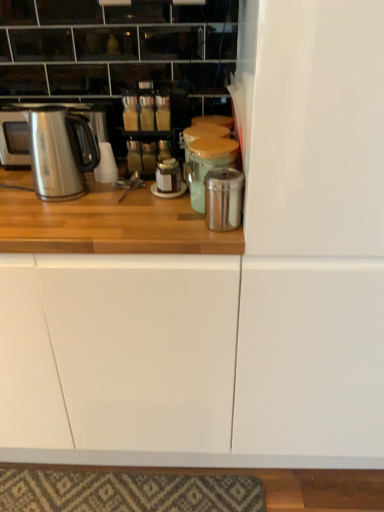
Question: Are metallic silver canister at center, which is counted as the 1th appliance, starting from the back, and shiny metallic canister at center, the 2th appliance viewed from the back, far apart?

Choices:
 (A) no
 (B) yes

Answer: (A)

Question: Does metallic silver canister at center, the second appliance from the front, have a greater width compared to shiny metallic canister at center, the 2th appliance viewed from the back?

Choices:
 (A) no
 (B) yes

Answer: (B)

Question: From a real-world perspective, is metallic silver canister at center, which is counted as the 1th appliance, starting from the back, on shiny metallic canister at center, arranged as the first appliance when viewed from the front?

Choices:
 (A) no
 (B) yes

Answer: (B)

Question: From the image's perspective, is metallic silver canister at center, which is counted as the 1th appliance, starting from the back, on top of shiny metallic canister at center, arranged as the first appliance when viewed from the front?

Choices:
 (A) no
 (B) yes

Answer: (B)

Question: Can you confirm if metallic silver canister at center, the second appliance from the front, is thinner than shiny metallic canister at center, the 2th appliance viewed from the back?

Choices:
 (A) no
 (B) yes

Answer: (A)

Question: Is metallic silver canister at center, which is counted as the 1th appliance, starting from the back, oriented away from shiny metallic canister at center, arranged as the first appliance when viewed from the front?

Choices:
 (A) yes
 (B) no

Answer: (B)

Question: Is stainless steel kettle at left completely or partially inside metallic silver fridge at center-right?

Choices:
 (A) yes
 (B) no

Answer: (B)

Question: From the image's perspective, is metallic silver fridge at center-right above stainless steel kettle at left?

Choices:
 (A) yes
 (B) no

Answer: (B)

Question: Is metallic silver fridge at center-right taller than stainless steel kettle at left?

Choices:
 (A) yes
 (B) no

Answer: (A)

Question: From a real-world perspective, does metallic silver fridge at center-right sit lower than stainless steel kettle at left?

Choices:
 (A) yes
 (B) no

Answer: (A)

Question: Does metallic silver fridge at center-right have a lesser width compared to stainless steel kettle at left?

Choices:
 (A) no
 (B) yes

Answer: (A)

Question: Is metallic silver fridge at center-right positioned behind stainless steel kettle at left?

Choices:
 (A) no
 (B) yes

Answer: (A)

Question: From a real-world perspective, is metallic silver canister at center, which is counted as the 1th appliance, starting from the back, physically below metallic silver fridge at center-right?

Choices:
 (A) no
 (B) yes

Answer: (A)